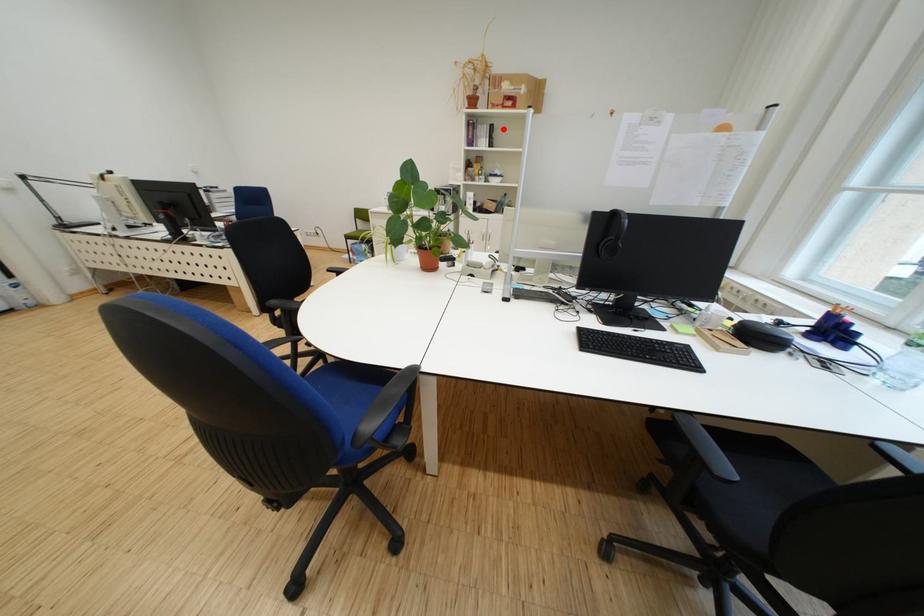
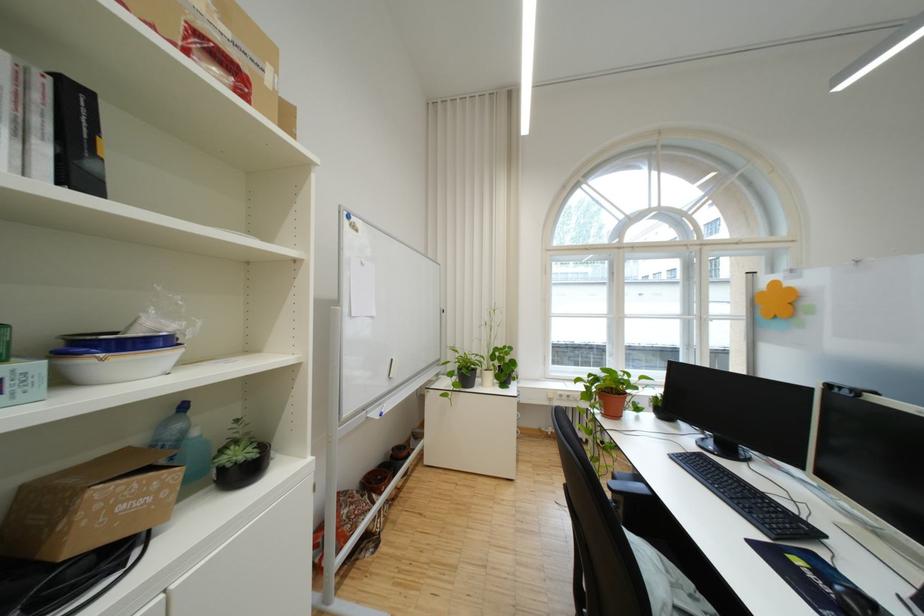
Question: I am providing you with two images of the same scene from different viewpoints. Given a red point in image1, look at the same physical point in image2. Is it:

Choices:
 (A) Closer to the viewpoint
 (B) Farther from the viewpoint

Answer: (B)